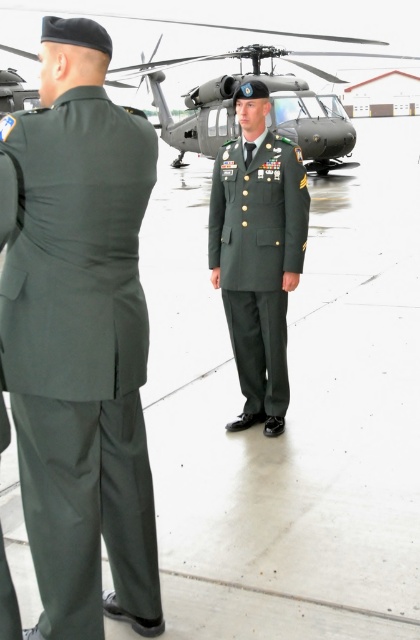
Question: Among these objects, which one is nearest to the camera?

Choices:
 (A) metallic gray helicopter at center
 (B) green fabric uniform at back

Answer: (B)

Question: Considering the relative positions of metallic gray helicopter at center and green matte uniform at center in the image provided, where is metallic gray helicopter at center located with respect to green matte uniform at center?

Choices:
 (A) above
 (B) below

Answer: (A)

Question: Which object is positioned farthest from the metallic gray helicopter at center?

Choices:
 (A) green matte uniform at center
 (B) green fabric uniform at back

Answer: (B)

Question: Is green fabric uniform at back below metallic gray helicopter at center?

Choices:
 (A) yes
 (B) no

Answer: (A)

Question: Can you confirm if green fabric uniform at back is wider than metallic gray helicopter at center?

Choices:
 (A) no
 (B) yes

Answer: (A)

Question: Considering the real-world distances, which object is farthest from the green matte uniform at center?

Choices:
 (A) green fabric uniform at back
 (B) metallic gray helicopter at center

Answer: (B)